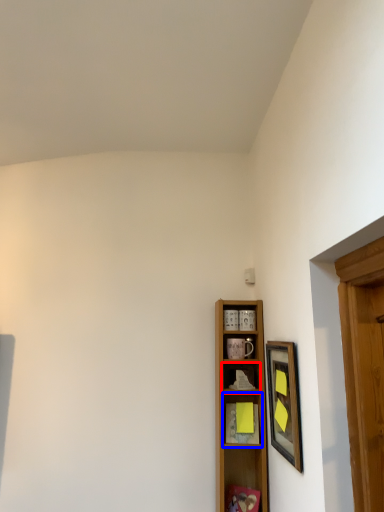
Question: Which of the following is the closest to the observer, shelf (highlighted by a red box) or shelf (highlighted by a blue box)?

Choices:
 (A) shelf
 (B) shelf

Answer: (B)